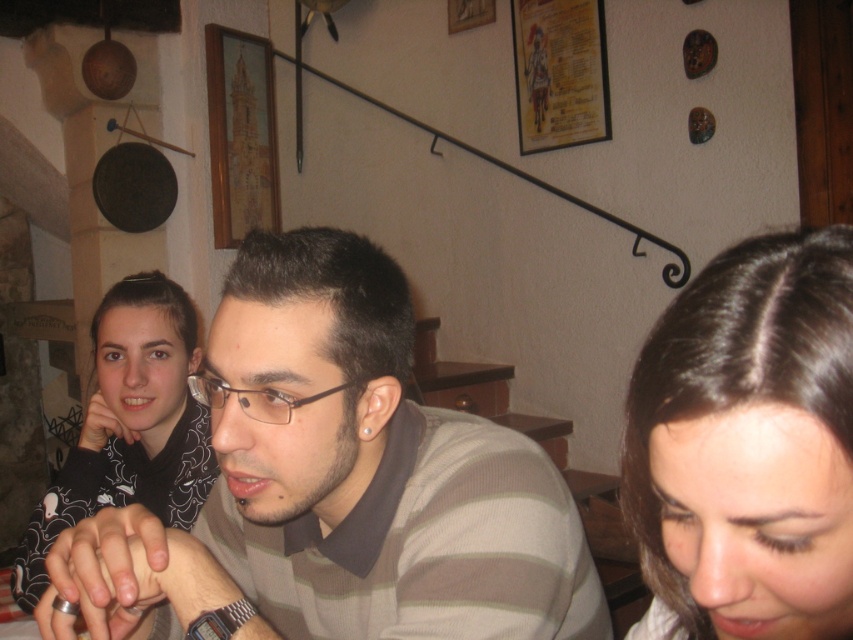
You are taking a photo of the scene and want to focus on both point (376, 486) and point (815, 541). Which point should you focus on first to ensure both are in focus?

You should focus on point (376, 486) first because it is closer to the camera than point (815, 541). This way, the depth of field will cover both points effectively.

You are a photographer trying to capture a candid shot of the dark brown hair at lower right and the black matte shirt at left. Which object is closer to the camera?

The dark brown hair at lower right is closer to the camera because it is in front of the black matte shirt at left.